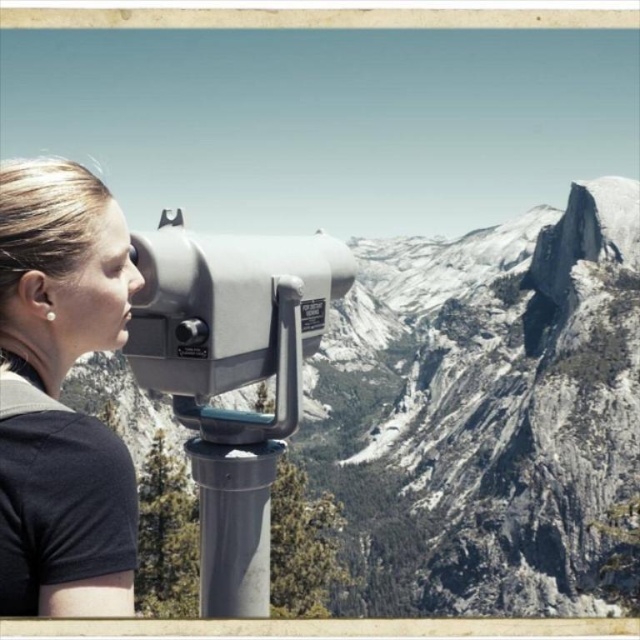
Question: In this image, where is granite rock formation at center located relative to metallic gray telescope at center?

Choices:
 (A) left
 (B) right

Answer: (B)

Question: Estimate the real-world distances between objects in this image. Which object is farther from the black matte shirt at center?

Choices:
 (A) metallic gray telescope at center
 (B) granite rock formation at center

Answer: (B)

Question: Estimate the real-world distances between objects in this image. Which object is farther from the black matte shirt at center?

Choices:
 (A) granite rock formation at center
 (B) metallic gray telescope at center

Answer: (A)

Question: Can you confirm if granite rock formation at center is positioned above metallic gray telescope at center?

Choices:
 (A) yes
 (B) no

Answer: (A)

Question: Can you confirm if granite rock formation at center is positioned to the left of black matte shirt at center?

Choices:
 (A) no
 (B) yes

Answer: (A)

Question: Which of the following is the farthest from the observer?

Choices:
 (A) (161, 244)
 (B) (128, 234)
 (C) (259, 500)

Answer: (C)